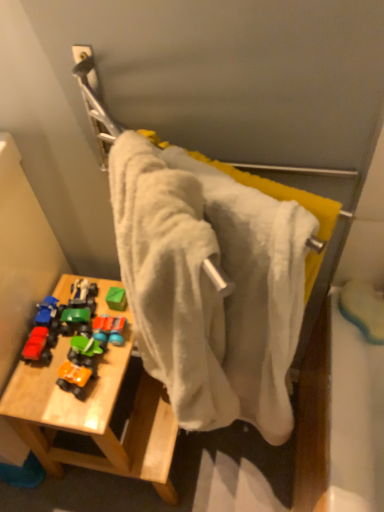
Question: Is matte red toy car at left, the first toy in the left-to-right sequence, wider or thinner than white fabric towel at center?

Choices:
 (A) wide
 (B) thin

Answer: (B)

Question: Based on their sizes in the image, would you say matte red toy car at left, which appears as the 4th toy when viewed from the right, is bigger or smaller than white fabric towel at center?

Choices:
 (A) big
 (B) small

Answer: (B)

Question: Based on their relative distances, which object is nearer to the matte red toy car at left, the first toy in the left-to-right sequence?

Choices:
 (A) rubberized plastic toy car at center, the 1th toy from the right
 (B) orange matte toy car at lower left, which is counted as the third toy, starting from the left
 (C) white fabric towel at center
 (D) matte blue car at left, which appears as the third toy when viewed from the right
 (E) wooden table at lower left

Answer: (D)

Question: Which object is the closest to the orange matte toy car at lower left, which is counted as the third toy, starting from the left?

Choices:
 (A) white fabric towel at center
 (B) matte blue car at left, placed as the 2th toy when sorted from left to right
 (C) rubberized plastic toy car at center, the fourth toy from the left
 (D) matte red toy car at left, which appears as the 4th toy when viewed from the right
 (E) wooden table at lower left

Answer: (D)